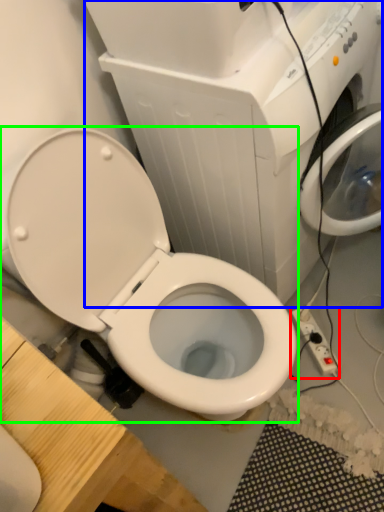
Question: Based on their relative distances, which object is nearer to electric outlet (highlighted by a red box)? Choose from appliance (highlighted by a blue box) and toilet (highlighted by a green box).

Choices:
 (A) appliance
 (B) toilet

Answer: (B)